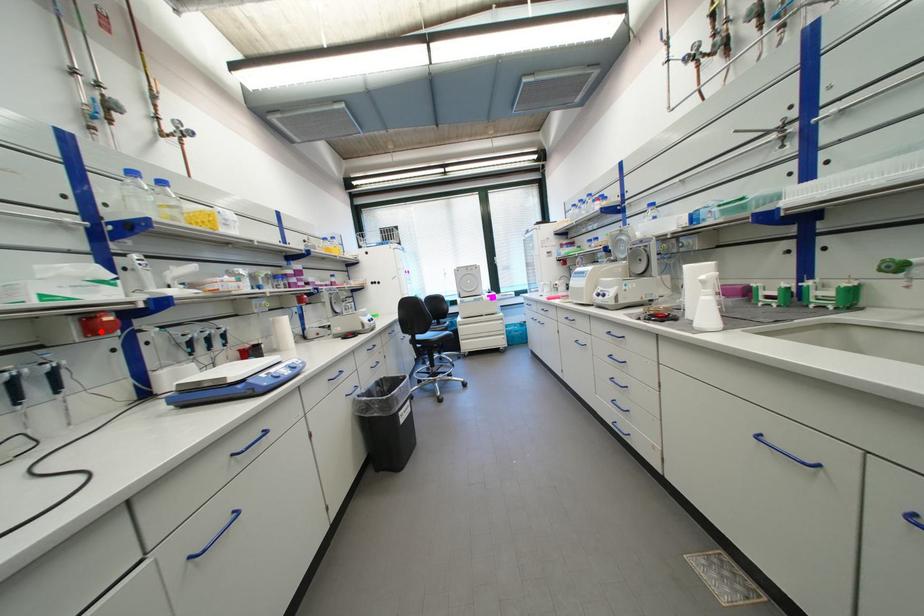
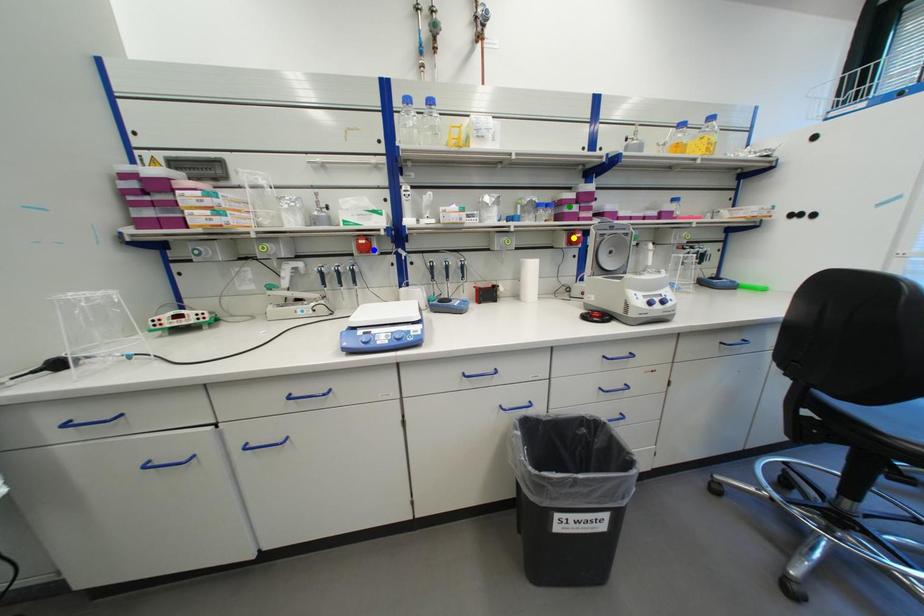
Question: I am providing you with two images of the same scene from different viewpoints. A red point is marked on the first image. You are given multiple points on the second image. Which point in image 2 is actually the same real-world point as the red point in image 1?

Choices:
 (A) green point
 (B) yellow point
 (C) blue point

Answer: (C)